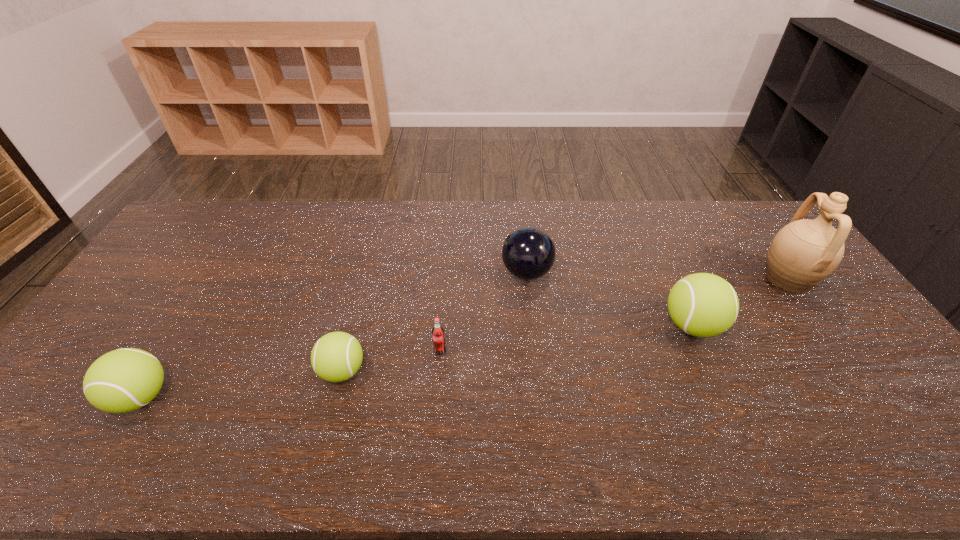
Identify the location of blank region between the rightmost object and the fourth object from left to right. This screenshot has width=960, height=540. [657, 275].

Identify the location of free space between the farthest tennis ball and the bowling ball. click(x=610, y=299).

Locate an element on the screen. free space between the soda bottle and the rightmost object is located at coordinates (613, 315).

The height and width of the screenshot is (540, 960). Identify the location of object that is the fourth closest to the soda bottle. (123, 380).

I want to click on the second closest object to the leftmost tennis ball, so click(438, 337).

Point out which tennis ball is positioned as the third nearest to the fourth object from left to right. Please provide its 2D coordinates. Your answer should be formatted as a tuple, i.e. [(x, y)], where the tuple contains the x and y coordinates of a point satisfying the conditions above.

[(123, 380)]

Locate an element on the screen. The width and height of the screenshot is (960, 540). tennis ball that is the second closest to the shortest tennis ball is located at coordinates (704, 305).

The image size is (960, 540). I want to click on vacant point that satisfies the following two spatial constraints: 1. on the side of the fourth object from left to right with the finger holes; 2. on the back side of the pitcher, so click(x=527, y=278).

Locate an element on the screen. Image resolution: width=960 pixels, height=540 pixels. vacant space that satisfies the following two spatial constraints: 1. on the side of the rightmost tennis ball with the finger holes; 2. on the right side of the bowling ball is located at coordinates (533, 326).

I want to click on free space that satisfies the following two spatial constraints: 1. on the back side of the farthest tennis ball; 2. on the right side of the rightmost object, so click(671, 278).